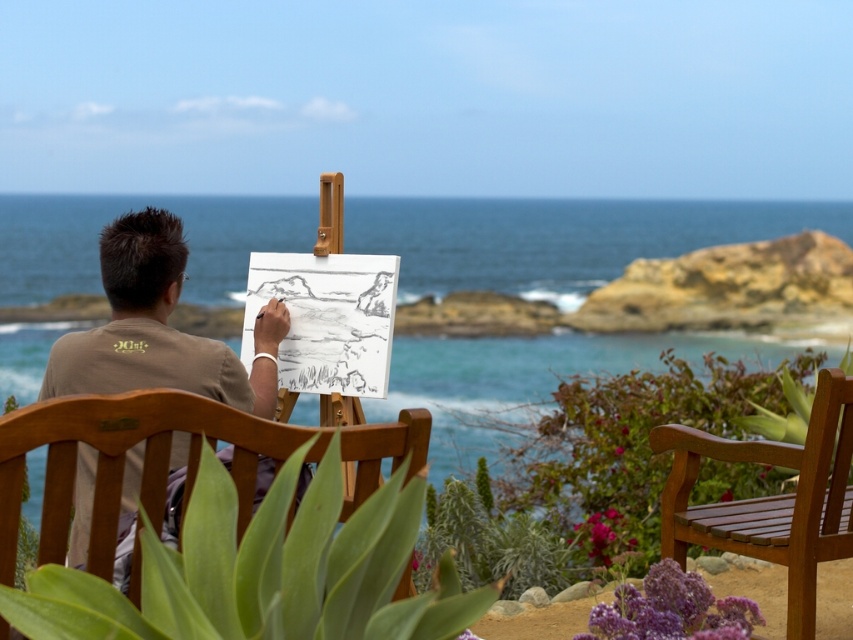
Question: Is blue water at center below teak wood bench at lower right?

Choices:
 (A) yes
 (B) no

Answer: (B)

Question: Does blue water at center have a smaller size compared to brown cotton shirt at center?

Choices:
 (A) yes
 (B) no

Answer: (B)

Question: Estimate the real-world distances between objects in this image. Which object is farther from the blue water at center?

Choices:
 (A) teak wood bench at lower right
 (B) wooden bench at center
 (C) brown cotton shirt at center

Answer: (C)

Question: Can you confirm if brown cotton shirt at center is thinner than teak wood bench at lower right?

Choices:
 (A) no
 (B) yes

Answer: (A)

Question: Which object is the closest to the teak wood bench at lower right?

Choices:
 (A) wooden bench at center
 (B) brown cotton shirt at center

Answer: (B)

Question: Among these objects, which one is nearest to the camera?

Choices:
 (A) brown cotton shirt at center
 (B) wooden bench at center
 (C) blue water at center

Answer: (B)